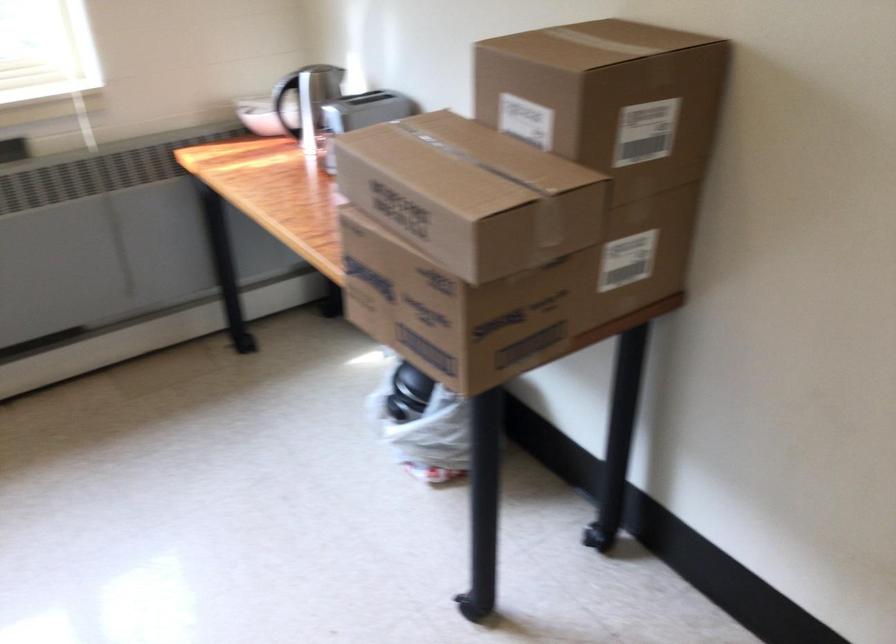
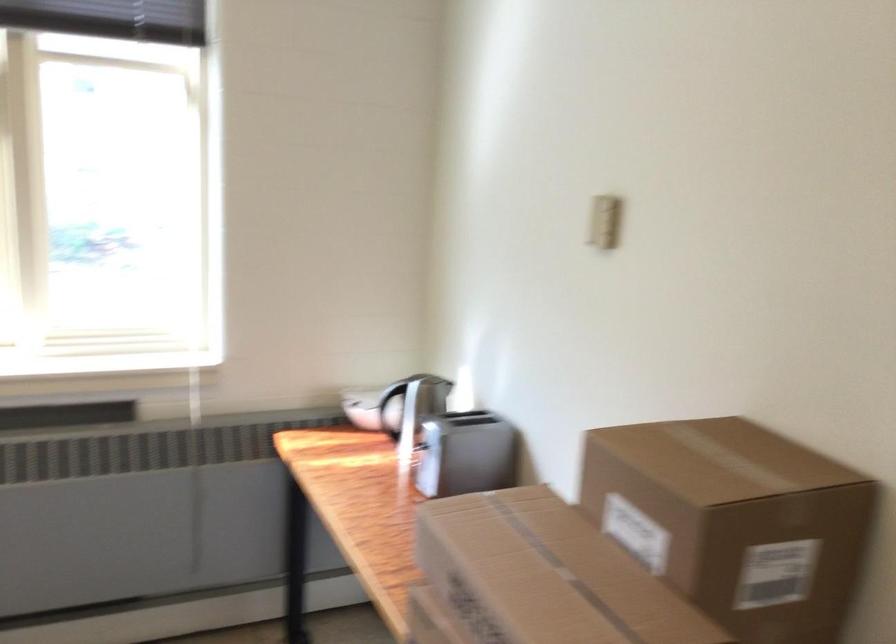
Question: How did the camera likely rotate?

Choices:
 (A) Left
 (B) Right
 (C) Up
 (D) Down

Answer: (C)